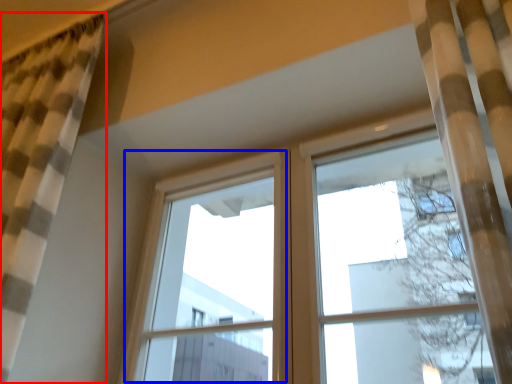
Question: Which object is closer to the camera taking this photo, curtain (highlighted by a red box) or window frame (highlighted by a blue box)?

Choices:
 (A) curtain
 (B) window frame

Answer: (A)